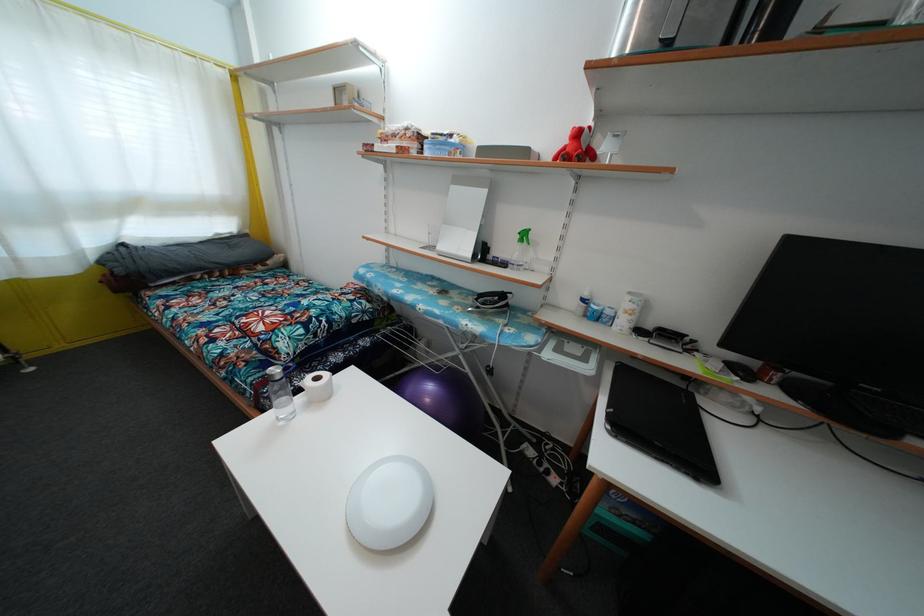
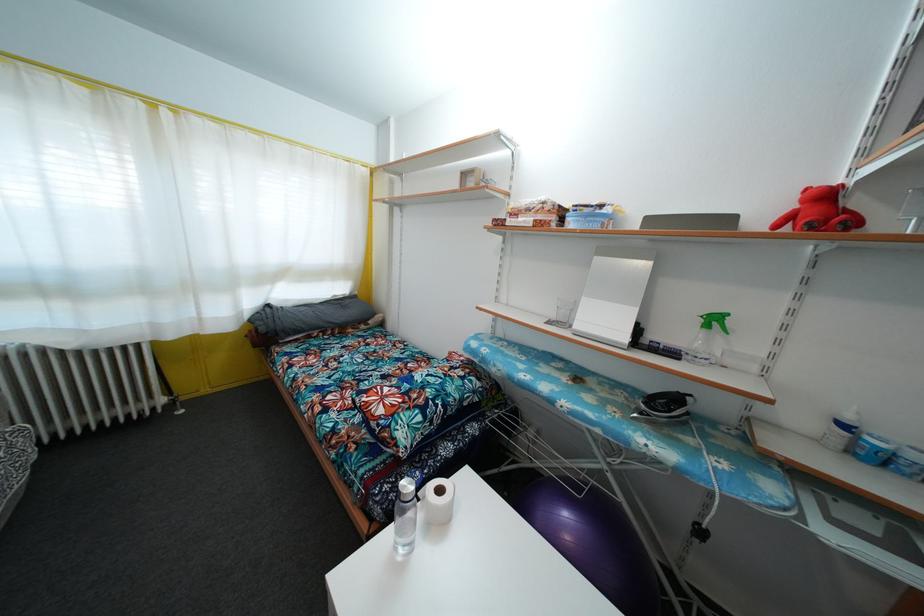
Locate, in the second image, the point that corresponds to point 588,307 in the first image.

(848, 432)